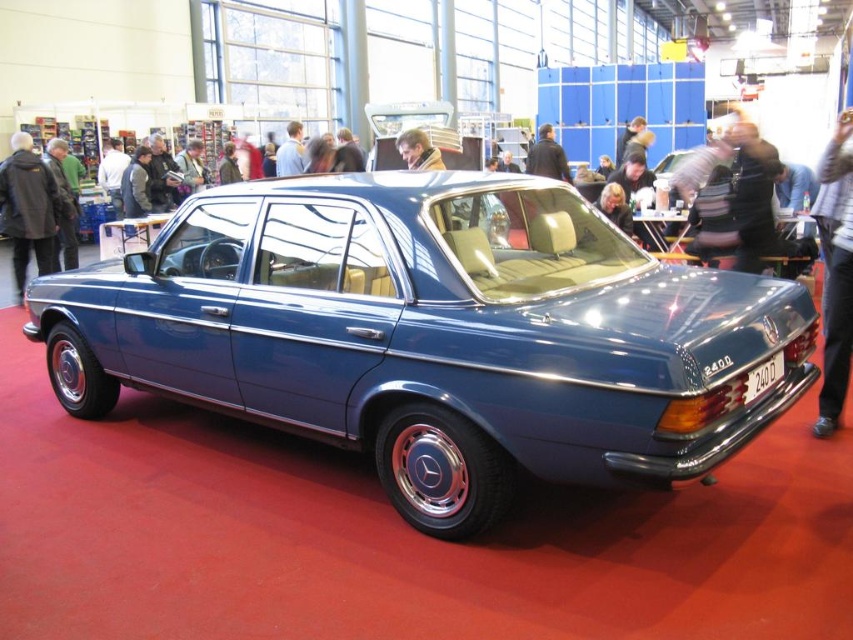
You are standing at the entrance of the car exhibition and want to take a photo of the Mercedes 240D sedan displayed on the red carpet. If your camera has a focal length of 50mm and you need to focus on the point at coordinates point (x=676, y=396), what is the minimum distance in meters you should be from the car to ensure the point is in focus?

The distance between point (x=676, y=396) and the camera is 2.66 meters, so you should be at least 2.66 meters away from the car to ensure the point is in focus.

Consider the image. You are attending a car exhibition and notice a metallic blue sedan at center and a dark blue leather jacket at upper center. Which object is located higher in the image?

A: The dark blue leather jacket at upper center is located higher in the image than the metallic blue sedan at center.